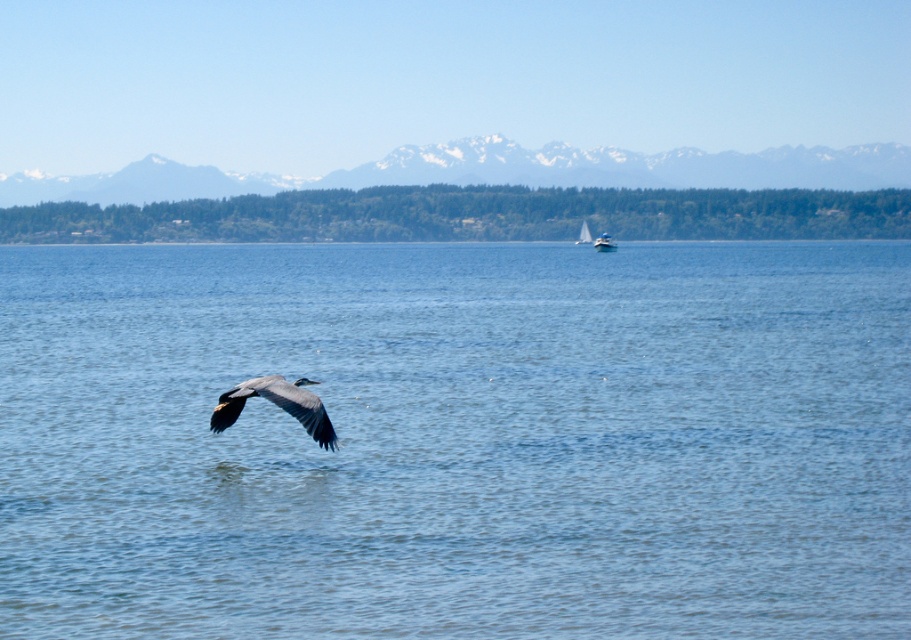
You are standing on the lakeside dock and see the gray matte bird at center and the white sailboat at center. Which object is positioned to the left of the other?

The gray matte bird at center is to the left of the white sailboat at center.

You are standing on the lakeside dock and see the blue water at center and the white plastic boat at center. Which object is positioned lower in the scene?

The blue water at center is positioned lower than the white plastic boat at center according to the description.